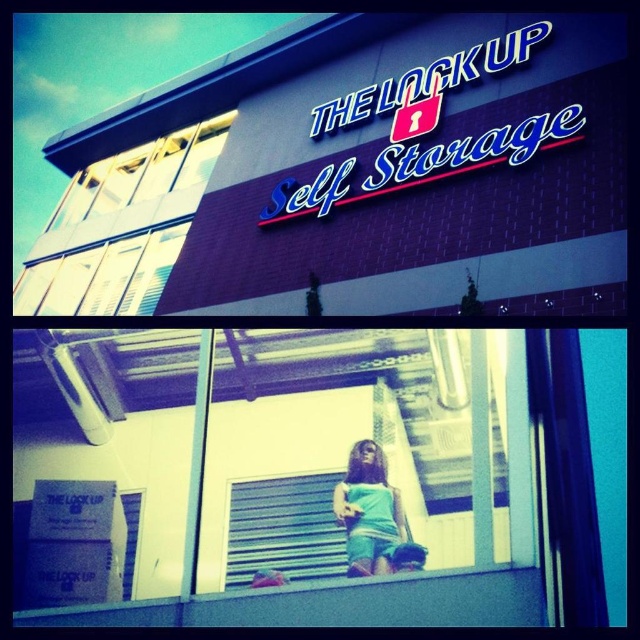
Does transparent glass window at upper left appear under teal fabric dress at center?

Actually, transparent glass window at upper left is above teal fabric dress at center.

Which of these two, transparent glass window at upper left or teal fabric dress at center, stands shorter?

teal fabric dress at center is shorter.

The height and width of the screenshot is (640, 640). I want to click on transparent glass window at upper left, so click(144, 173).

Between purple brick sign at upper center and teal fabric dress at center, which one is positioned higher?

purple brick sign at upper center is higher up.

Between purple brick sign at upper center and teal fabric dress at center, which one appears on the left side from the viewer's perspective?

purple brick sign at upper center is more to the left.

Does point (252, 184) come farther from viewer compared to point (376, 461)?

That is True.

Identify the location of purple brick sign at upper center. This screenshot has height=640, width=640. (353, 177).

Does point (352, 120) lie in front of point (186, 147)?

That is True.

Describe the element at coordinates (353, 177) in the screenshot. This screenshot has width=640, height=640. I see `purple brick sign at upper center` at that location.

Does point (472, 243) lie behind point (186, 173)?

No, (472, 243) is in front of (186, 173).

Where is `purple brick sign at upper center`? This screenshot has height=640, width=640. purple brick sign at upper center is located at coordinates (353, 177).